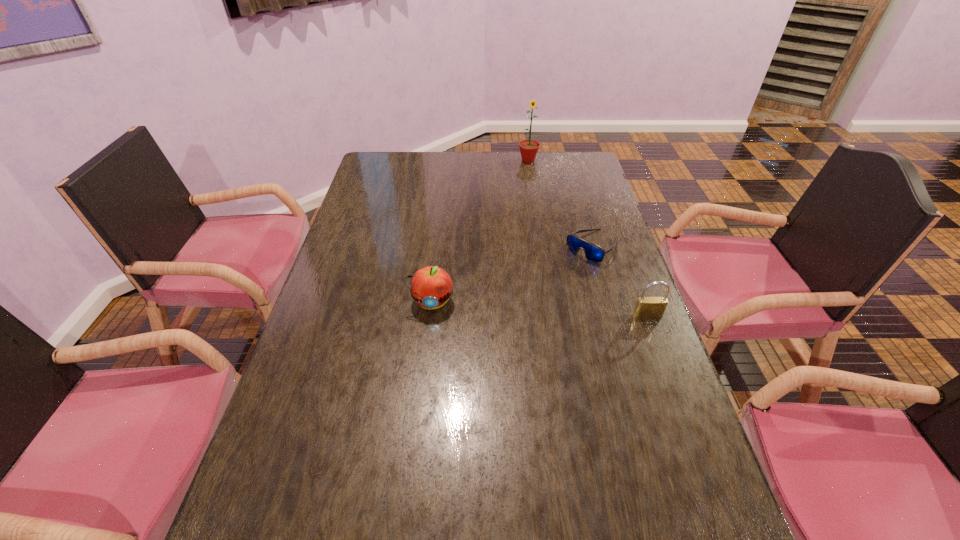
The width and height of the screenshot is (960, 540). Find the location of `vacant spot on the desktop that is between the leftmost object and the padlock and is positioned on the face of the second object from left to right`. vacant spot on the desktop that is between the leftmost object and the padlock and is positioned on the face of the second object from left to right is located at coordinates (559, 310).

The height and width of the screenshot is (540, 960). What are the coordinates of `vacant space on the desktop that is between the apple and the padlock and is positioned on the front-facing side of the third nearest object` in the screenshot? It's located at (526, 308).